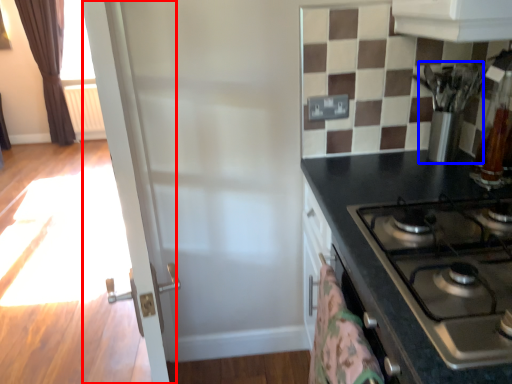
Question: Among these objects, which one is farthest to the camera, screen door (highlighted by a red box) or appliance (highlighted by a blue box)?

Choices:
 (A) screen door
 (B) appliance

Answer: (B)